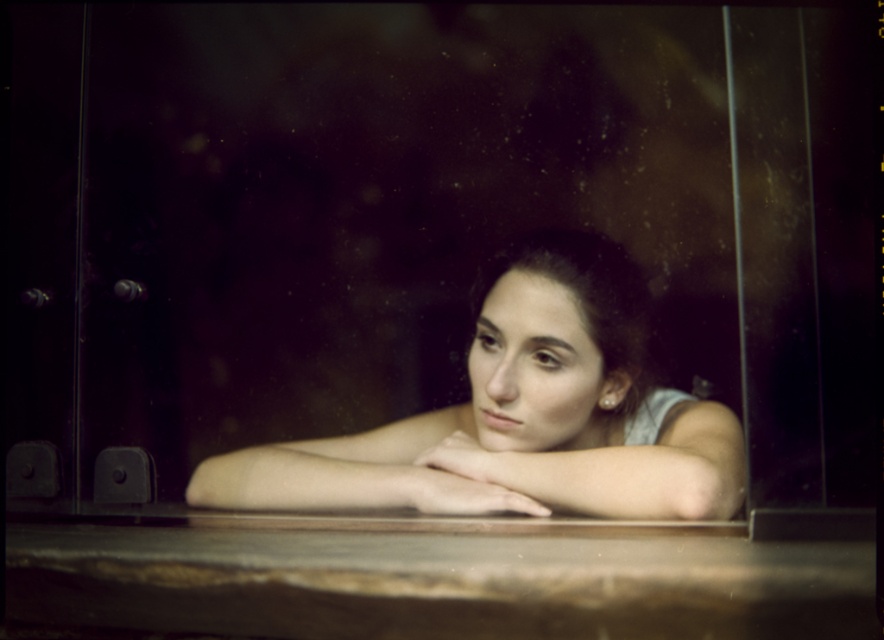
Can you confirm if matte skin girl at center is positioned below matte skin arm at center?

Yes, matte skin girl at center is below matte skin arm at center.

Is matte skin girl at center to the right of matte skin arm at center from the viewer's perspective?

In fact, matte skin girl at center is to the left of matte skin arm at center.

Locate an element on the screen. This screenshot has height=640, width=884. matte skin girl at center is located at coordinates (522, 413).